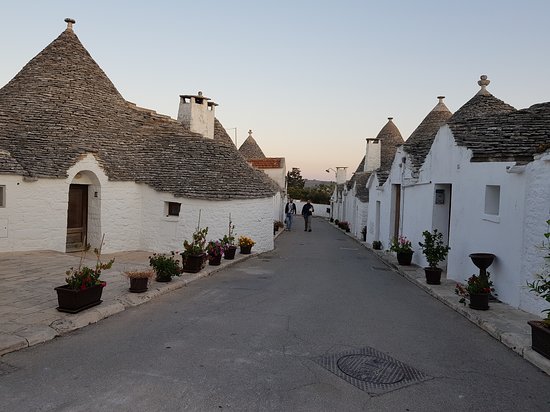
Identify the location of window. The image size is (550, 412). (1, 203), (170, 213), (491, 196).